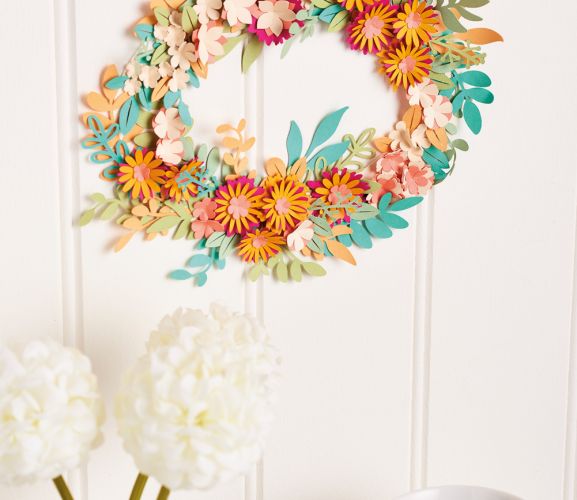
Identify the location of wall. This screenshot has height=500, width=577. (478, 286).